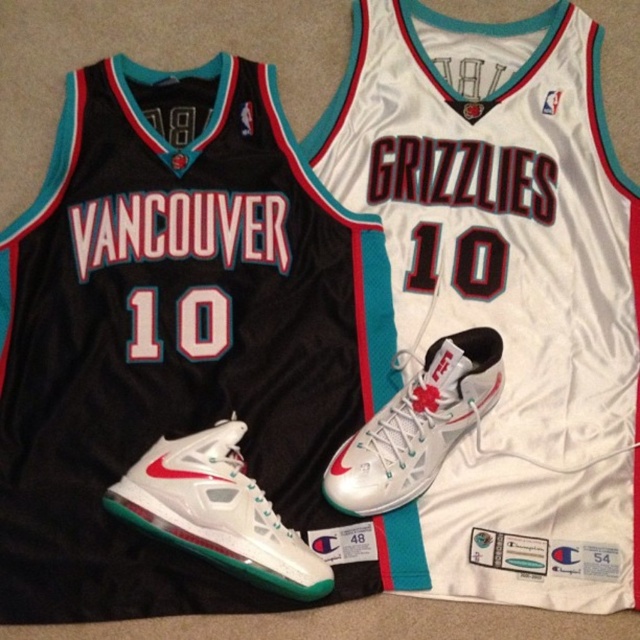
You are organizing a sports equipment room and need to place the white mesh shoe at center and the metallic silver sneaker at center in a row. According to the image, which sneaker should be placed to the left of the other?

The white mesh shoe at center should be placed to the left of the metallic silver sneaker at center because the white mesh shoe at center is positioned on the left side of metallic silver sneaker at center in the image.

In the scene shown: You are a photographer setting up a shoot. You have a white matte jersey at center and a metallic silver sneaker at center in front of you. You want to ensure the jersey is in focus while the sneaker is slightly blurred. Based on their positions, can you achieve this effect without moving any objects?

The white matte jersey at center is closer to the viewer than the metallic silver sneaker at center. By focusing on the jersey and using a shallow depth of field, you can keep the jersey in focus while the sneaker becomes blurred.

You are standing at the origin point in the image and want to move towards the white mesh shoe at center. Which direction should you move in to reach it?

The white mesh shoe at center is located at point 0.800 on the x axis and 0.341 on the y axis. Since you are at the origin, you should move towards the right and slightly upwards to reach the white mesh shoe at center.